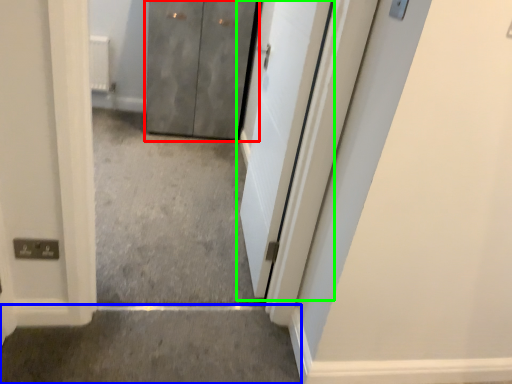
Question: Estimate the real-world distances between objects in this image. Which object is closer to door (highlighted by a red box), concrete (highlighted by a blue box) or door (highlighted by a green box)?

Choices:
 (A) concrete
 (B) door

Answer: (B)